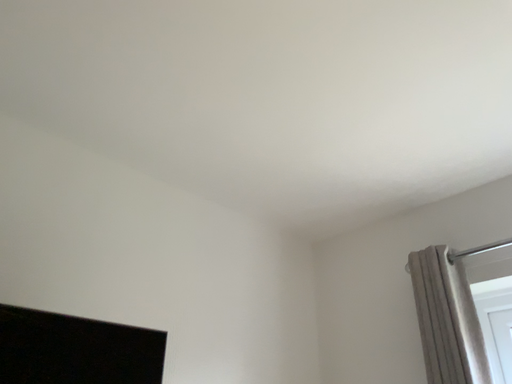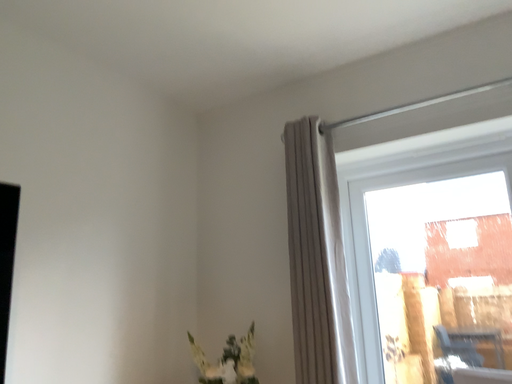
Question: Which way did the camera rotate in the video?

Choices:
 (A) rotated right
 (B) rotated left

Answer: (A)